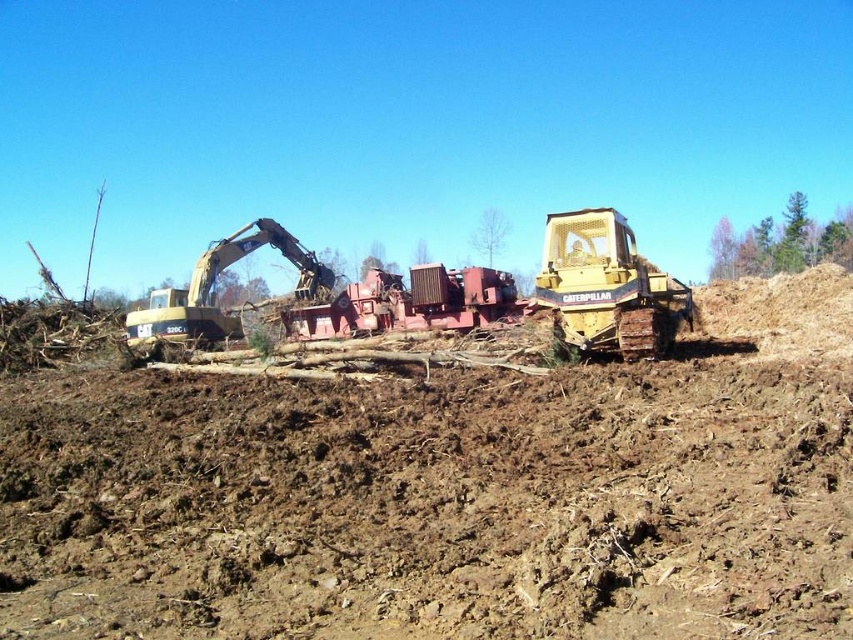
Can you confirm if brown soil at center is shorter than red metal tractor at center?

No.

Is brown soil at center smaller than red metal tractor at center?

Incorrect, brown soil at center is not smaller in size than red metal tractor at center.

The image size is (853, 640). I want to click on brown soil at center, so click(450, 493).

Does point (421, 268) lie behind point (132, 323)?

That is False.

Which is behind, point (383, 298) or point (187, 308)?

The point (383, 298) is more distant.

At what (x,y) coordinates should I click in order to perform the action: click on red metal tractor at center. Please return your answer as a coordinate pair (x, y). This screenshot has height=640, width=853. Looking at the image, I should click on (410, 301).

Is the position of brown soil at center more distant than that of gold metallic excavator at left?

No, brown soil at center is in front of gold metallic excavator at left.

Does brown soil at center appear on the left side of gold metallic excavator at left?

In fact, brown soil at center is to the right of gold metallic excavator at left.

Which is behind, point (225, 429) or point (192, 342)?

Point (192, 342)

Where is `brown soil at center`? The height and width of the screenshot is (640, 853). brown soil at center is located at coordinates (450, 493).